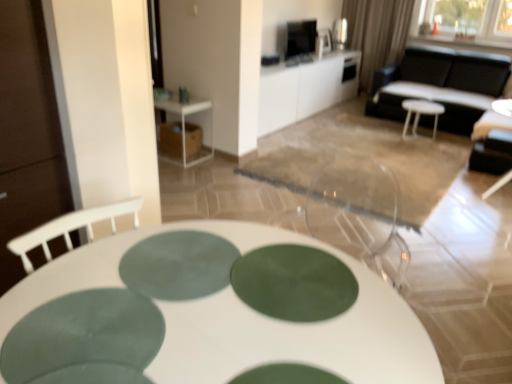
Question: Does white plastic stool at center have a smaller size compared to white plastic side table at upper left, which is the 2th table from bottom to top?

Choices:
 (A) yes
 (B) no

Answer: (A)

Question: Is white plastic side table at upper left, which is the 2th table from bottom to top, a part of white plastic stool at center?

Choices:
 (A) yes
 (B) no

Answer: (B)

Question: From a real-world perspective, is white plastic stool at center beneath white plastic side table at upper left, which is the 2th table in front-to-back order?

Choices:
 (A) no
 (B) yes

Answer: (B)

Question: Is the surface of white plastic stool at center in direct contact with white plastic side table at upper left, which is the 2th table in front-to-back order?

Choices:
 (A) no
 (B) yes

Answer: (A)

Question: Is white plastic stool at center looking in the opposite direction of white plastic side table at upper left, acting as the second table starting from the back?

Choices:
 (A) yes
 (B) no

Answer: (B)

Question: Considering their positions, is black leather couch at upper right located in front of or behind white glossy table at center, placed as the 1th table when sorted from front to back?

Choices:
 (A) front
 (B) behind

Answer: (B)

Question: Is black leather couch at upper right to the left or to the right of white glossy table at center, positioned as the 3th table in top-to-bottom order, in the image?

Choices:
 (A) left
 (B) right

Answer: (B)

Question: From the image's perspective, is black leather couch at upper right positioned above or below white glossy table at center, arranged as the third table when viewed from the back?

Choices:
 (A) above
 (B) below

Answer: (A)

Question: Is point (402, 77) positioned closer to the camera than point (93, 244)?

Choices:
 (A) farther
 (B) closer

Answer: (A)

Question: Is white glossy table at center, arranged as the third table when viewed from the back, inside or outside of black leather couch at upper right?

Choices:
 (A) outside
 (B) inside

Answer: (A)

Question: Considering the positions of point (254, 347) and point (423, 74), is point (254, 347) closer or farther from the camera than point (423, 74)?

Choices:
 (A) closer
 (B) farther

Answer: (A)

Question: From their relative heights in the image, would you say white glossy table at center, arranged as the third table when viewed from the back, is taller or shorter than black leather couch at upper right?

Choices:
 (A) tall
 (B) short

Answer: (B)

Question: From a real-world perspective, is white glossy table at center, positioned as the 3th table in top-to-bottom order, physically located above or below black leather couch at upper right?

Choices:
 (A) above
 (B) below

Answer: (B)

Question: From the image's perspective, is black leather couch at upper right positioned above or below green matte placemat at center?

Choices:
 (A) above
 (B) below

Answer: (A)

Question: Is black leather couch at upper right to the left or to the right of green matte placemat at center in the image?

Choices:
 (A) left
 (B) right

Answer: (B)